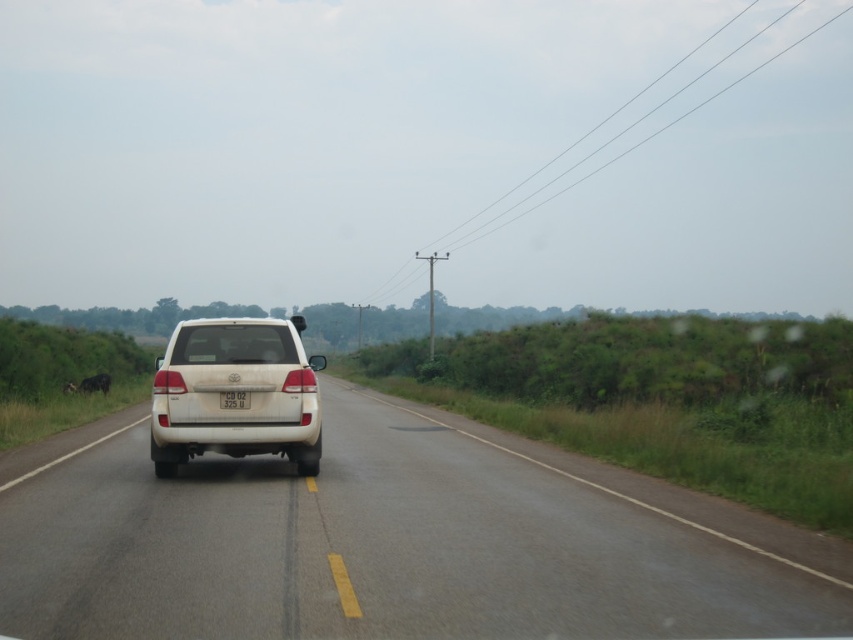
Question: Is white glossy suv at center above white plastic license plate at center?

Choices:
 (A) yes
 (B) no

Answer: (B)

Question: Which of the following is the closest to the observer?

Choices:
 (A) (85, 380)
 (B) (245, 451)
 (C) (236, 403)

Answer: (C)

Question: Estimate the real-world distances between objects in this image. Which object is closer to the dark brown fur at left?

Choices:
 (A) white matte suv at center
 (B) white glossy suv at center
 (C) white plastic license plate at center

Answer: (A)

Question: Can you confirm if dark brown fur at left is wider than white plastic license plate at center?

Choices:
 (A) no
 (B) yes

Answer: (B)

Question: Which object appears farthest from the camera in this image?

Choices:
 (A) white plastic license plate at center
 (B) white glossy suv at center
 (C) dark brown fur at left

Answer: (C)

Question: Is white glossy suv at center wider than dark brown fur at left?

Choices:
 (A) no
 (B) yes

Answer: (B)